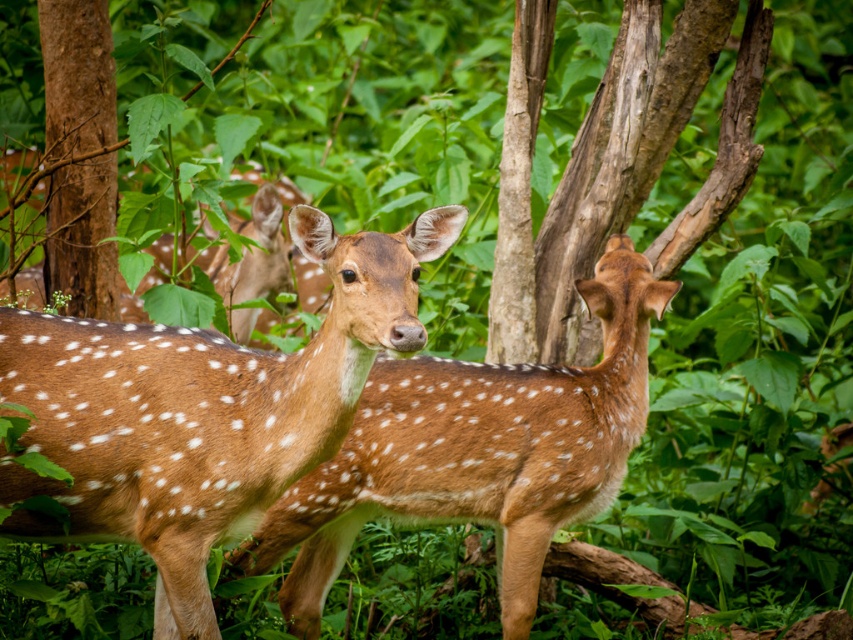
Question: Which of the following is the closest to the observer?

Choices:
 (A) (451, 445)
 (B) (57, 212)
 (C) (155, 392)

Answer: (C)

Question: Considering the relative positions of brown spotted fur at center and brown speckled fur at center in the image provided, where is brown spotted fur at center located with respect to brown speckled fur at center?

Choices:
 (A) right
 (B) left

Answer: (B)

Question: Which point appears farthest from the camera in this image?

Choices:
 (A) pyautogui.click(x=312, y=464)
 (B) pyautogui.click(x=78, y=276)
 (C) pyautogui.click(x=532, y=611)

Answer: (B)

Question: Is brown speckled fur at center to the left of brown rough tree trunk at left from the viewer's perspective?

Choices:
 (A) no
 (B) yes

Answer: (A)

Question: Can you confirm if brown speckled fur at center is smaller than brown rough tree trunk at left?

Choices:
 (A) yes
 (B) no

Answer: (B)

Question: Among these points, which one is nearest to the camera?

Choices:
 (A) (125, 349)
 (B) (386, 499)
 (C) (45, 269)

Answer: (A)